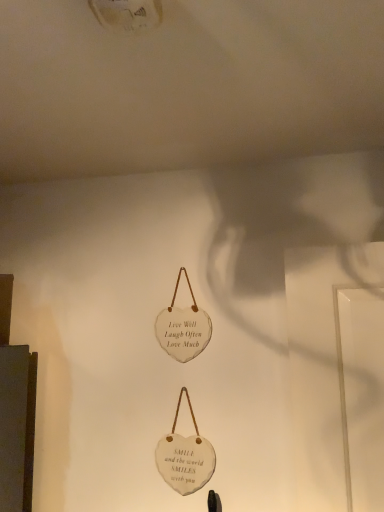
Question: In terms of width, does white stone heart at center, which is the first handbag in top-to-bottom order, look wider or thinner when compared to white stone heart at center, arranged as the first handbag when ordered from the bottom?

Choices:
 (A) thin
 (B) wide

Answer: (B)

Question: Relative to white stone heart at center, the 2th handbag viewed from the top, is white stone heart at center, which is the first handbag in top-to-bottom order, in front or behind?

Choices:
 (A) front
 (B) behind

Answer: (B)

Question: From their relative heights in the image, would you say white stone heart at center, which is the first handbag in top-to-bottom order, is taller or shorter than white stone heart at center, arranged as the first handbag when ordered from the bottom?

Choices:
 (A) short
 (B) tall

Answer: (B)

Question: From a real-world perspective, is white stone heart at center, the 2th handbag viewed from the top, positioned above or below white stone heart at center, the 2th handbag positioned from the bottom?

Choices:
 (A) above
 (B) below

Answer: (B)

Question: Considering their positions, is white stone heart at center, the 2th handbag viewed from the top, located in front of or behind white stone heart at center, which is the first handbag in top-to-bottom order?

Choices:
 (A) behind
 (B) front

Answer: (B)

Question: Looking at their shapes, would you say white stone heart at center, arranged as the first handbag when ordered from the bottom, is wider or thinner than white stone heart at center, the 2th handbag positioned from the bottom?

Choices:
 (A) wide
 (B) thin

Answer: (B)

Question: From the image's perspective, is white stone heart at center, the 2th handbag viewed from the top, positioned above or below white stone heart at center, the 2th handbag positioned from the bottom?

Choices:
 (A) below
 (B) above

Answer: (A)